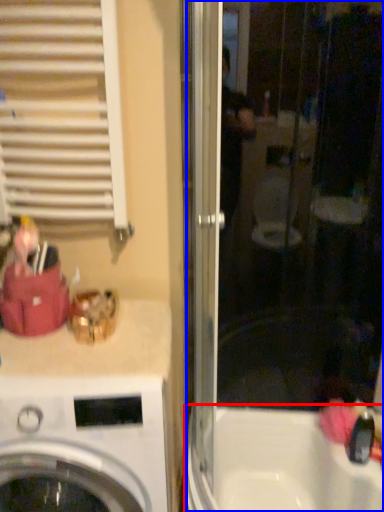
Question: Which of the following is the farthest to the observer, bath (highlighted by a red box) or screen door (highlighted by a blue box)?

Choices:
 (A) bath
 (B) screen door

Answer: (A)